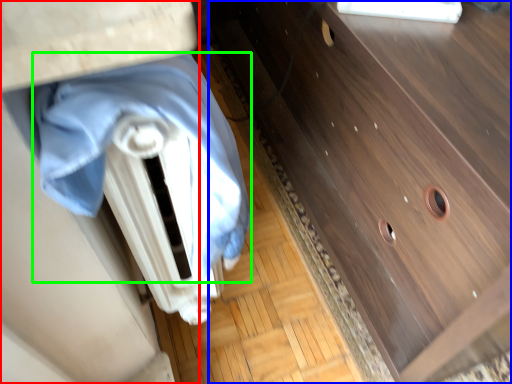
Question: Which object is the farthest from vanity (highlighted by a red box)? Choose among these: chest of drawers (highlighted by a blue box) or blanket (highlighted by a green box).

Choices:
 (A) chest of drawers
 (B) blanket

Answer: (A)